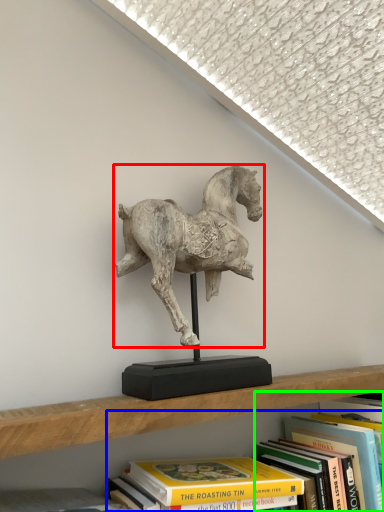
Question: Considering the real-world distances, which object is farthest from horse (highlighted by a red box)? book (highlighted by a blue box) or book (highlighted by a green box)?

Choices:
 (A) book
 (B) book

Answer: (B)